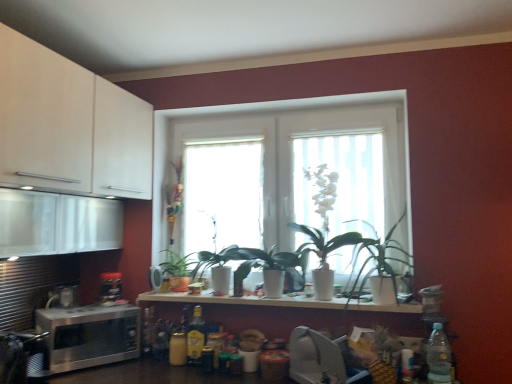
Image resolution: width=512 pixels, height=384 pixels. What are the coordinates of `satin silver microwave at left, the 2th appliance positioned from the left` in the screenshot? It's located at [155, 278].

Locate an element on the screen. The height and width of the screenshot is (384, 512). green matte plant at center, which is the second houseplant in back-to-front order is located at coordinates (378, 261).

In order to face white glossy windows at center, should I rotate leftwards or rightwards?

Rotate right and turn 3.179 degrees.

Describe the element at coordinates (300, 159) in the screenshot. I see `white glossy windows at center` at that location.

I want to click on white glossy pot at center, the 2th plant positioned from the left, so click(x=324, y=215).

In order to face translucent glass bottle at center, positioned as the 1th bottle in left-to-right order, should I rotate leftwards or rightwards?

It's best to rotate left around 14.057 degrees.

Image resolution: width=512 pixels, height=384 pixels. Find the location of `translucent glass bottle at center, the 3th bottle from the front`. translucent glass bottle at center, the 3th bottle from the front is located at coordinates (147, 331).

What do you see at coordinates (438, 357) in the screenshot? I see `clear plastic bottle at lower right, placed as the third bottle when sorted from back to front` at bounding box center [438, 357].

You are a GUI agent. You are given a task and a screenshot of the screen. Output one action in this format:
    pyautogui.click(x=<x>, y=<y>)
    Task: Click on the satin silver microwave at left, arranged as the third appliance when viewed from the front
    
    Given the screenshot: What is the action you would take?
    pyautogui.click(x=155, y=278)

Does metallic silver toaster at lower center, acting as the first appliance starting from the right, touch green matte plant at center, which is the first houseplant in front-to-back order?

No, metallic silver toaster at lower center, acting as the first appliance starting from the right, is not making contact with green matte plant at center, which is the first houseplant in front-to-back order.

Considering the relative positions of metallic silver toaster at lower center, acting as the first appliance starting from the right, and green matte plant at center, which is the first houseplant in front-to-back order, in the image provided, is metallic silver toaster at lower center, acting as the first appliance starting from the right, to the left of green matte plant at center, which is the first houseplant in front-to-back order, from the viewer's perspective?

Correct, you'll find metallic silver toaster at lower center, acting as the first appliance starting from the right, to the left of green matte plant at center, which is the first houseplant in front-to-back order.

From the image's perspective, is metallic silver toaster at lower center, acting as the first appliance starting from the right, located above or below green matte plant at center, which is the first houseplant in front-to-back order?

metallic silver toaster at lower center, acting as the first appliance starting from the right, is situated lower than green matte plant at center, which is the first houseplant in front-to-back order, in the image.

Which object is positioned more to the right, metallic silver toaster at lower center, marked as the 3th appliance in a back-to-front arrangement, or white glossy pot at center, which appears as the second plant when viewed from the right?

metallic silver toaster at lower center, marked as the 3th appliance in a back-to-front arrangement, is more to the right.

From the picture: From the image's perspective, is metallic silver toaster at lower center, the third appliance in the left-to-right sequence, located above or below white glossy pot at center, which appears as the second plant when viewed from the right?

metallic silver toaster at lower center, the third appliance in the left-to-right sequence, is below white glossy pot at center, which appears as the second plant when viewed from the right.

From a real-world perspective, which object stands above the other?

In real-world perspective, white glossy pot at center, which appears as the second plant when viewed from the right, is above.

From a real-world perspective, which object rests below the other?

From a 3D spatial view, satin silver microwave at left, the 2th appliance positioned from the left, is below.

Does point (153, 282) come closer to viewer compared to point (327, 186)?

That is False.

Which of these two, satin silver microwave at left, acting as the 1th appliance starting from the back, or white glossy pot at center, the 2th plant positioned from the left, is bigger?

With larger size is white glossy pot at center, the 2th plant positioned from the left.

Is satin silver microwave at left, acting as the 1th appliance starting from the back, aimed at white glossy pot at center, arranged as the first plant when viewed from the right?

No, satin silver microwave at left, acting as the 1th appliance starting from the back, is not oriented towards white glossy pot at center, arranged as the first plant when viewed from the right.

From the image's perspective, is translucent glass bottle at center, acting as the 3th bottle starting from the right, on satin silver microwave at left, acting as the 1th appliance starting from the back?

No, from the image's perspective, translucent glass bottle at center, acting as the 3th bottle starting from the right, is not over satin silver microwave at left, acting as the 1th appliance starting from the back.

In the scene shown: Who is taller, translucent glass bottle at center, arranged as the first bottle when viewed from the back, or satin silver microwave at left, the 2th appliance positioned from the left?

translucent glass bottle at center, arranged as the first bottle when viewed from the back, is taller.

Between translucent glass bottle at center, the 3th bottle from the front, and satin silver microwave at left, acting as the 1th appliance starting from the back, which one is positioned in front?

translucent glass bottle at center, the 3th bottle from the front, is closer to the camera.

From the image's perspective, which object appears higher, satin silver microwave at lower left, which ranks as the second appliance in front-to-back order, or clear plastic bottle at lower right, which appears as the 1th bottle when viewed from the right?

From the image's view, clear plastic bottle at lower right, which appears as the 1th bottle when viewed from the right, is above.

From the image's perspective, which appliance is the 2nd one below the clear plastic bottle at lower right, placed as the third bottle when sorted from back to front? Please provide its 2D coordinates.

[(21, 357)]

Is satin silver microwave at lower left, the first appliance viewed from the left, positioned in front of clear plastic bottle at lower right, marked as the third bottle in a left-to-right arrangement?

No, it is behind clear plastic bottle at lower right, marked as the third bottle in a left-to-right arrangement.

Could you tell me if satin silver microwave at lower left, the first appliance viewed from the left, is facing clear plastic bottle at lower right, placed as the third bottle when sorted from back to front?

Yes, satin silver microwave at lower left, the first appliance viewed from the left, is aimed at clear plastic bottle at lower right, placed as the third bottle when sorted from back to front.

From the image's perspective, is yellow glass bottle at center, marked as the 2th bottle in a right-to-left arrangement, positioned above or below satin silver microwave at lower left?

Clearly, from the image's perspective, yellow glass bottle at center, marked as the 2th bottle in a right-to-left arrangement, is above satin silver microwave at lower left.

Can you confirm if yellow glass bottle at center, which appears as the second bottle when viewed from the front, is bigger than satin silver microwave at lower left?

No, yellow glass bottle at center, which appears as the second bottle when viewed from the front, is not bigger than satin silver microwave at lower left.

Consider the image. Is yellow glass bottle at center, acting as the 2th bottle starting from the back, inside or outside of satin silver microwave at lower left?

yellow glass bottle at center, acting as the 2th bottle starting from the back, exists outside the volume of satin silver microwave at lower left.

Is translucent glass bottle at center, positioned as the 1th bottle in left-to-right order, at the back of green matte plant at center, the 1th houseplant from the back?

green matte plant at center, the 1th houseplant from the back, is not turned away from translucent glass bottle at center, positioned as the 1th bottle in left-to-right order.

Looking at this image, which is correct: green matte plant at center, the 1th houseplant from the back, is inside translucent glass bottle at center, acting as the 3th bottle starting from the right, or outside of it?

green matte plant at center, the 1th houseplant from the back, is not enclosed by translucent glass bottle at center, acting as the 3th bottle starting from the right.

Is green matte plant at center, which appears as the second houseplant when viewed from the right, to the right of translucent glass bottle at center, the 3th bottle from the front, from the viewer's perspective?

Correct, you'll find green matte plant at center, which appears as the second houseplant when viewed from the right, to the right of translucent glass bottle at center, the 3th bottle from the front.

From the image's perspective, which houseplant is the 2nd one above the metallic silver toaster at lower center, acting as the first appliance starting from the right? Please provide its 2D coordinates.

[(378, 261)]

The height and width of the screenshot is (384, 512). What are the coordinates of `the 1st plant directly above the metallic silver toaster at lower center, the third appliance in the left-to-right sequence (from a real-world perspective)` in the screenshot? It's located at (216, 261).

Based on their spatial positions, is satin silver microwave at lower left, the third appliance when ordered from right to left, or white glossy windows at center closer to translucent glass window at center?

The object closer to translucent glass window at center is white glossy windows at center.

Based on their spatial positions, is white glossy windows at center or translucent glass window at center closer to white matte countertop at center?

translucent glass window at center.

When comparing their distances from white glossy pot at center, which appears as the second plant when viewed from the right, does metallic silver toaster at lower center, the 1th appliance when ordered from front to back, or white glossy pot at center, arranged as the first plant when viewed from the right, seem closer?

white glossy pot at center, arranged as the first plant when viewed from the right, is positioned closer to the anchor white glossy pot at center, which appears as the second plant when viewed from the right.

When comparing their distances from white matte countertop at center, does satin silver microwave at lower left or metallic silver toaster at lower center, acting as the first appliance starting from the right, seem further?

Based on the image, satin silver microwave at lower left appears to be further to white matte countertop at center.

Based on their spatial positions, is clear plastic bottle at lower right, marked as the third bottle in a left-to-right arrangement, or white glossy pot at center, the 2th plant positioned from the left, further from satin silver microwave at left, arranged as the third appliance when viewed from the front?

Among the two, clear plastic bottle at lower right, marked as the third bottle in a left-to-right arrangement, is located further to satin silver microwave at left, arranged as the third appliance when viewed from the front.

Which object lies nearer to the anchor point white matte countertop at center, translucent glass bottle at center, positioned as the 1th bottle in left-to-right order, or metallic silver toaster at lower center, marked as the 3th appliance in a back-to-front arrangement?

metallic silver toaster at lower center, marked as the 3th appliance in a back-to-front arrangement, is positioned closer to the anchor white matte countertop at center.

Based on their spatial positions, is metallic silver toaster at lower center, acting as the first appliance starting from the right, or green matte plant at center, marked as the second houseplant in a front-to-back arrangement, closer to satin silver microwave at lower left?

The object closer to satin silver microwave at lower left is green matte plant at center, marked as the second houseplant in a front-to-back arrangement.

Consider the image. Which object lies nearer to the anchor point satin silver microwave at left, the 2th appliance positioned from the left, clear plastic bottle at lower right, marked as the third bottle in a left-to-right arrangement, or translucent glass bottle at center, the 3th bottle from the front?

Based on the image, translucent glass bottle at center, the 3th bottle from the front, appears to be nearer to satin silver microwave at left, the 2th appliance positioned from the left.

At what (x,y) coordinates should I click in order to perform the action: click on window between satin silver microwave at lower left and green matte plant at center, which is the first houseplant in front-to-back order, from left to right. Please return your answer as a coordinate pair (x, y). Looking at the image, I should click on (300, 159).

The width and height of the screenshot is (512, 384). I want to click on houseplant between satin silver microwave at lower left and white glossy pot at center, the 2th plant positioned from the left, in the horizontal direction, so click(x=178, y=270).

I want to click on window located between satin silver microwave at lower left, which ranks as the second appliance in front-to-back order, and white glossy pot at center, the 2th plant positioned from the left, in the left-right direction, so click(x=300, y=159).

Find the location of a particular element. This screenshot has height=384, width=512. bottle situated between green matte plant at center, marked as the second houseplant in a front-to-back arrangement, and metallic silver toaster at lower center, the 1th appliance when ordered from front to back, from left to right is located at coordinates (195, 337).